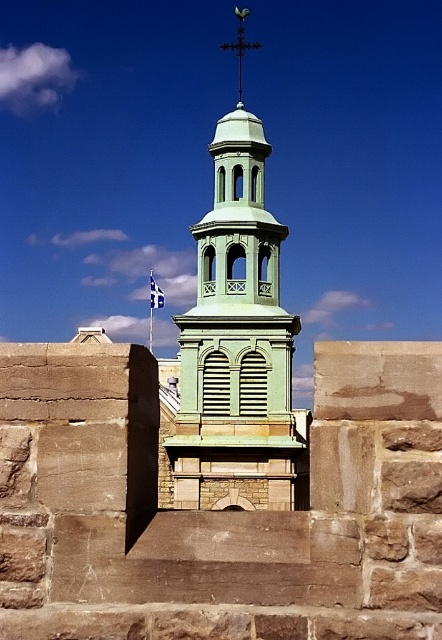
Question: Which point is farther to the camera?

Choices:
 (A) green matte tower at center
 (B) black metal cross at upper center

Answer: (B)

Question: Does green matte tower at center appear on the left side of black metal cross at upper center?

Choices:
 (A) no
 (B) yes

Answer: (B)

Question: Is green matte tower at center above black metal cross at upper center?

Choices:
 (A) no
 (B) yes

Answer: (A)

Question: Which object is farther from the camera taking this photo?

Choices:
 (A) black metal cross at upper center
 (B) green matte tower at center

Answer: (A)

Question: Among these objects, which one is nearest to the camera?

Choices:
 (A) green matte tower at center
 (B) black metal cross at upper center

Answer: (A)

Question: Does green matte tower at center have a greater width compared to black metal cross at upper center?

Choices:
 (A) yes
 (B) no

Answer: (A)